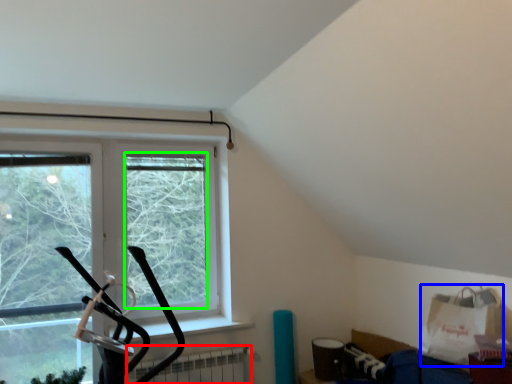
Question: Estimate the real-world distances between objects in this image. Which object is farther from radiator (highlighted by a red box), grocery bag (highlighted by a blue box) or window screen (highlighted by a green box)?

Choices:
 (A) grocery bag
 (B) window screen

Answer: (A)